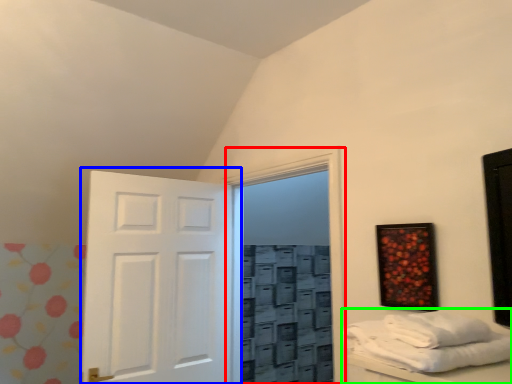
Question: Based on their relative distances, which object is farther from glass door (highlighted by a red box)? Choose from door (highlighted by a blue box) and furniture (highlighted by a green box).

Choices:
 (A) door
 (B) furniture

Answer: (B)